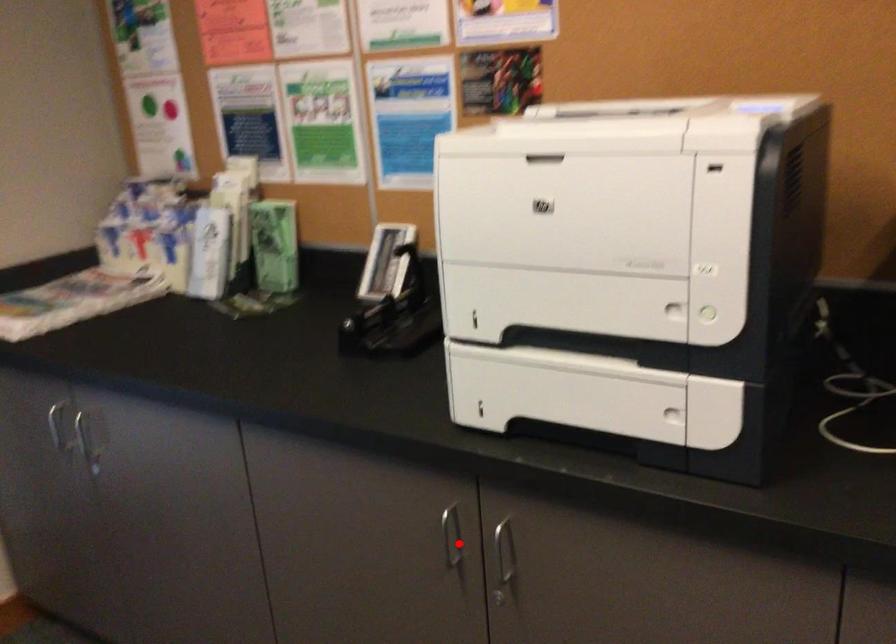
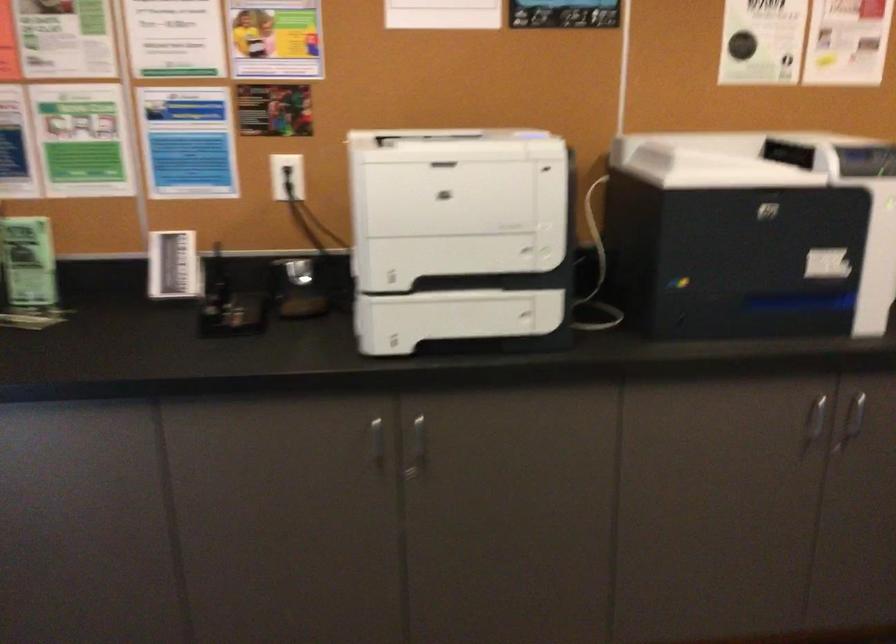
Question: I am providing you with two images of the same scene from different viewpoints. A red point is shown in image1. For the corresponding object point in image2, is it positioned nearer or farther from the camera?

Choices:
 (A) Nearer
 (B) Farther

Answer: (B)